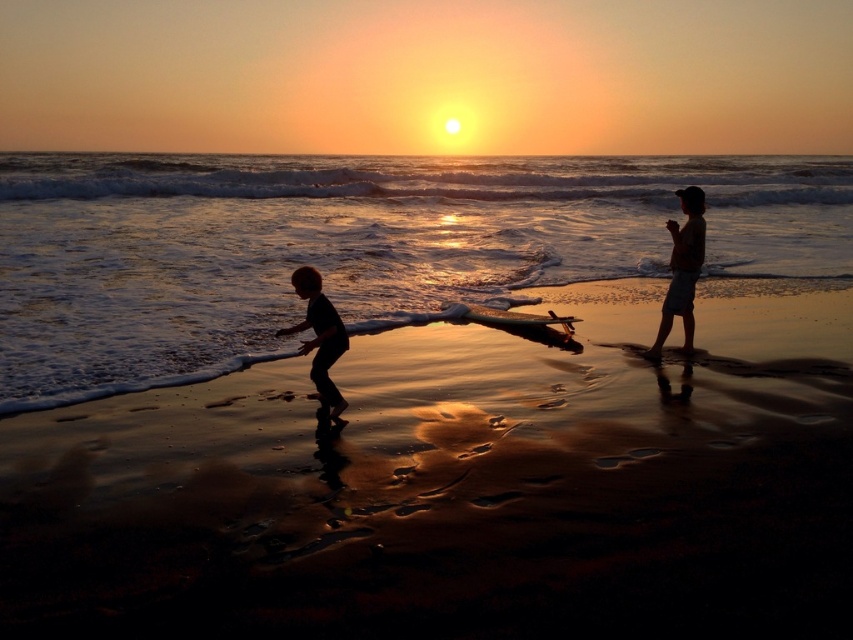
You are standing at the point marked as point (350, 246) on the beach. What material would you feel under your feet?

The material at point (350, 246) is reflective wet sand at lower center, so you would feel wet sand under your feet.

You are a photographer trying to capture the sunset reflections on the beach. You notice two areas of sand at the lower center of the image. Which area, the shiny sand at lower center or the reflective wet sand at lower center, would likely provide a better surface for capturing the sunset reflections?

The reflective wet sand at lower center would likely provide a better surface for capturing the sunset reflections since it occupies more space than the shiny sand at lower center.

You are a photographer trying to capture the silhouette child at lower left and the shiny sand at lower center in a single shot. Based on their heights, which one will appear larger in the photo?

The silhouette child at lower left will appear larger in the photo because it has a greater height than the shiny sand at lower center.